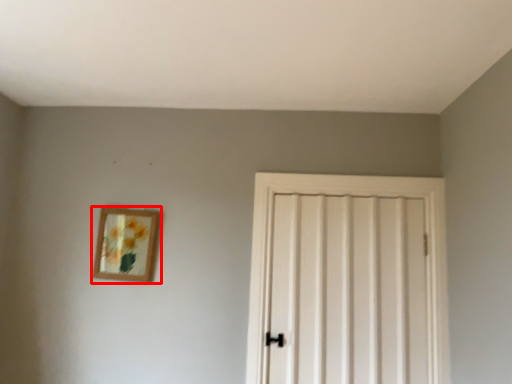
Question: From the image's perspective, considering the relative positions of picture frame (annotated by the red box) and door in the image provided, where is picture frame (annotated by the red box) located with respect to the staircase?

Choices:
 (A) above
 (B) below

Answer: (A)